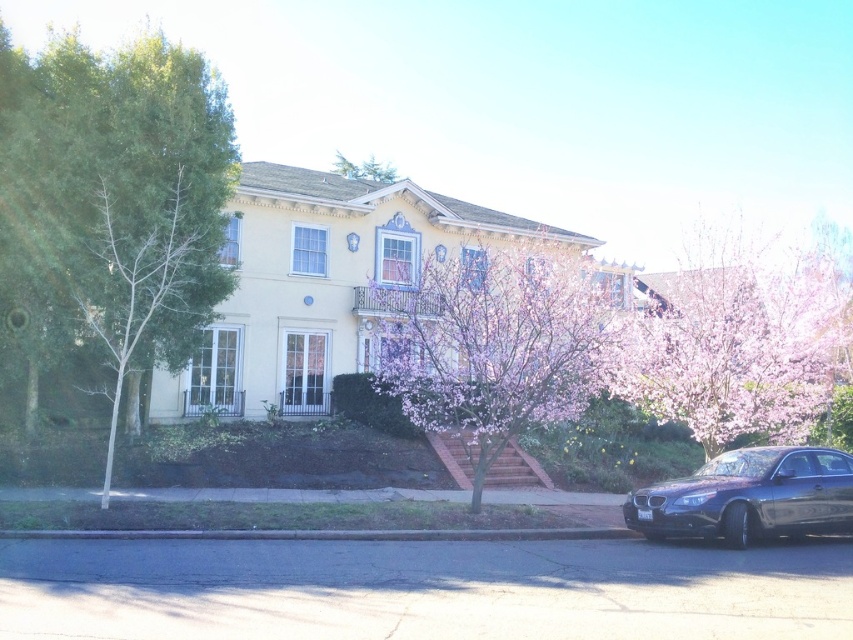
Measure the distance between green leafy tree at left and pink blossoming tree at center.

The distance of green leafy tree at left from pink blossoming tree at center is 9.60 meters.

Image resolution: width=853 pixels, height=640 pixels. Describe the element at coordinates (114, 198) in the screenshot. I see `green leafy tree at left` at that location.

Identify the location of green leafy tree at left. (114, 198).

Who is more distant from viewer, (257, 532) or (386, 179)?

Point (386, 179)

Which is below, dark gray concrete curb at lower left or green matte tree at upper center?

dark gray concrete curb at lower left is below.

Is point (207, 529) farther from viewer compared to point (337, 164)?

No, it is in front of (337, 164).

Locate an element on the screen. Image resolution: width=853 pixels, height=640 pixels. dark gray concrete curb at lower left is located at coordinates (328, 532).

Can you confirm if pink blossoming tree at center is shorter than pink blossoming tree at right?

Indeed, pink blossoming tree at center has a lesser height compared to pink blossoming tree at right.

Based on the photo, can you confirm if pink blossoming tree at center is thinner than pink blossoming tree at right?

Correct, pink blossoming tree at center's width is less than pink blossoming tree at right's.

Which is behind, point (544, 344) or point (780, 364)?

Positioned behind is point (780, 364).

Where is `pink blossoming tree at center`? This screenshot has height=640, width=853. pink blossoming tree at center is located at coordinates (495, 344).